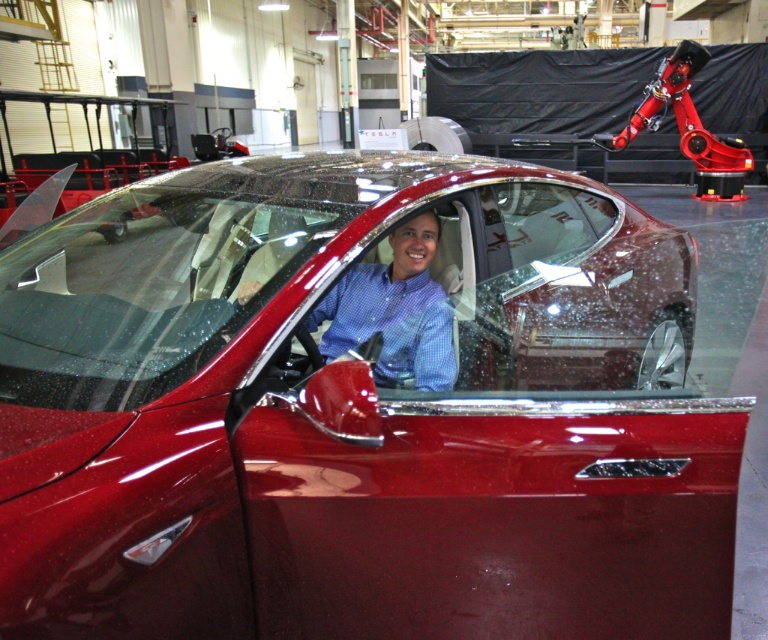
Who is more forward, (596, 296) or (346, 340)?

Point (346, 340) is more forward.

Does clear glass windshield at center appear on the right side of blue checkered shirt at center?

Indeed, clear glass windshield at center is positioned on the right side of blue checkered shirt at center.

The height and width of the screenshot is (640, 768). In order to click on clear glass windshield at center in this screenshot , I will do `click(346, 280)`.

Where is `clear glass windshield at center`? The height and width of the screenshot is (640, 768). clear glass windshield at center is located at coordinates (346, 280).